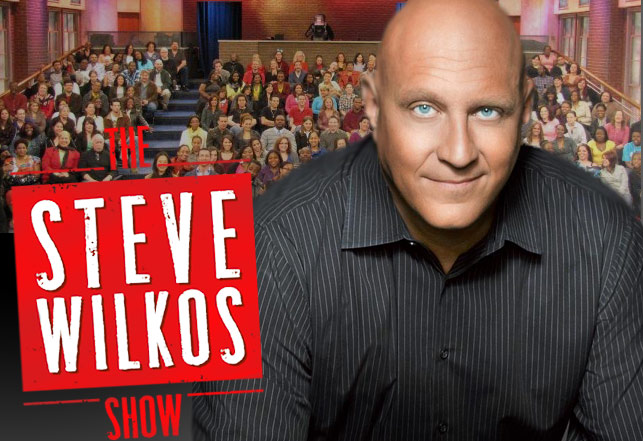
Locate an element on the screen. The image size is (643, 441). stairs is located at coordinates (190, 95), (186, 109), (179, 116), (170, 131), (161, 143).